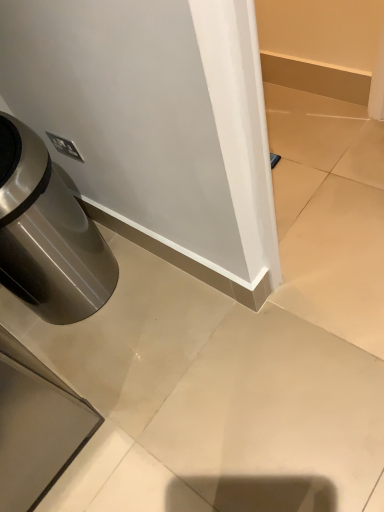
Question: Can you confirm if brushed metal trash can at lower left is wider than white glossy baseboard at center?

Choices:
 (A) no
 (B) yes

Answer: (A)

Question: Could you tell me if brushed metal trash can at lower left is facing white glossy baseboard at center?

Choices:
 (A) yes
 (B) no

Answer: (A)

Question: Is brushed metal trash can at lower left beside white glossy baseboard at center?

Choices:
 (A) no
 (B) yes

Answer: (A)

Question: Can you confirm if brushed metal trash can at lower left is smaller than white glossy baseboard at center?

Choices:
 (A) no
 (B) yes

Answer: (A)

Question: Is brushed metal trash can at lower left closer to the viewer compared to white glossy baseboard at center?

Choices:
 (A) no
 (B) yes

Answer: (A)

Question: From the image's perspective, would you say brushed metal trash can at lower left is positioned over white glossy baseboard at center?

Choices:
 (A) yes
 (B) no

Answer: (A)

Question: Can we say white glossy baseboard at center lies outside brushed metal trash can at lower left?

Choices:
 (A) yes
 (B) no

Answer: (A)

Question: Considering the relative sizes of white glossy baseboard at center and brushed metal trash can at lower left in the image provided, is white glossy baseboard at center bigger than brushed metal trash can at lower left?

Choices:
 (A) no
 (B) yes

Answer: (A)

Question: Is the depth of white glossy baseboard at center greater than that of brushed metal trash can at lower left?

Choices:
 (A) no
 (B) yes

Answer: (A)

Question: From the image's perspective, is white glossy baseboard at center under brushed metal trash can at lower left?

Choices:
 (A) no
 (B) yes

Answer: (B)

Question: Can you confirm if white glossy baseboard at center is smaller than brushed metal trash can at lower left?

Choices:
 (A) yes
 (B) no

Answer: (A)

Question: Is white glossy baseboard at center positioned with its back to brushed metal trash can at lower left?

Choices:
 (A) no
 (B) yes

Answer: (A)

Question: Considering the positions of point (316, 331) and point (3, 179), is point (316, 331) closer or farther from the camera than point (3, 179)?

Choices:
 (A) closer
 (B) farther

Answer: (B)